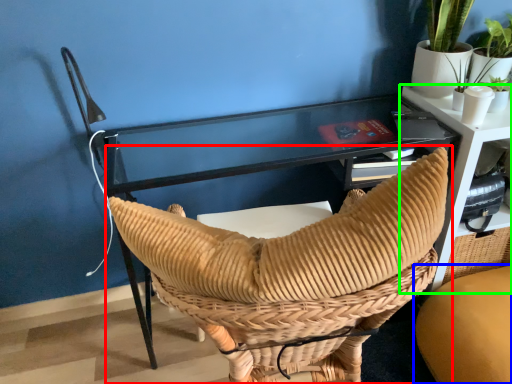
Question: Which object is positioned farthest from chair (highlighted by a red box)? Select from chair (highlighted by a blue box) and table (highlighted by a green box).

Choices:
 (A) chair
 (B) table

Answer: (B)